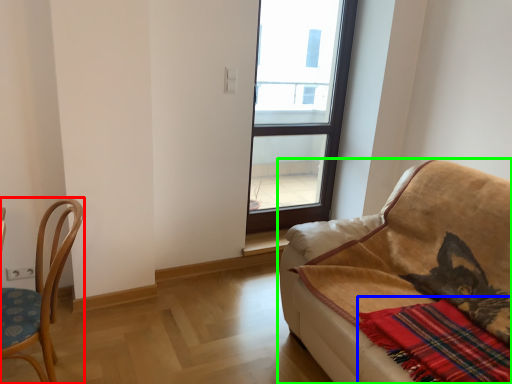
Question: Considering the real-world distances, which object is closest to chair (highlighted by a red box)? plaid (highlighted by a blue box) or studio couch (highlighted by a green box).

Choices:
 (A) plaid
 (B) studio couch

Answer: (B)